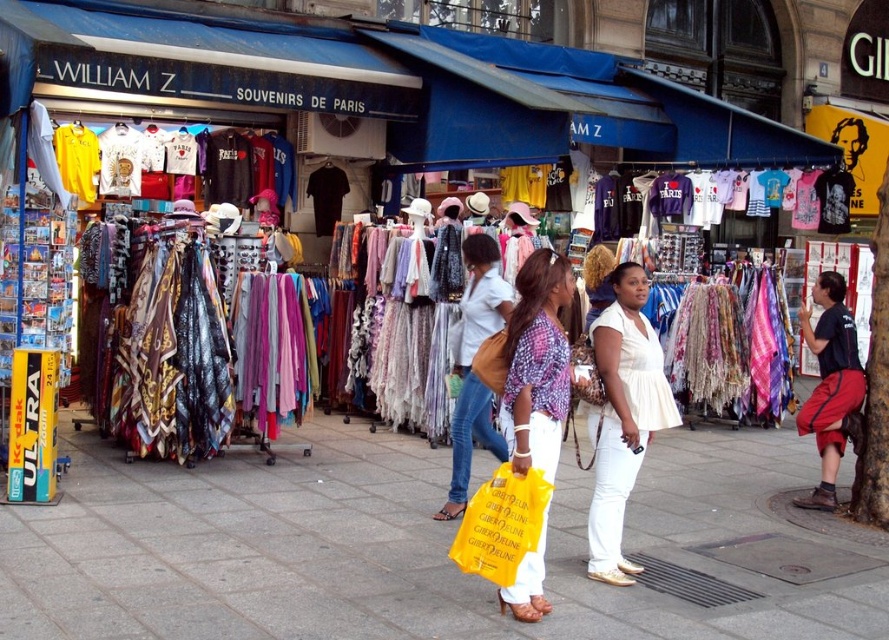
Identify the location of smooth concrete pavement at center. (404, 548).

Can you confirm if smooth concrete pavement at center is thinner than white cotton blouse at center?

Indeed, smooth concrete pavement at center has a lesser width compared to white cotton blouse at center.

Describe the element at coordinates (404, 548) in the screenshot. I see `smooth concrete pavement at center` at that location.

The height and width of the screenshot is (640, 889). What are the coordinates of `smooth concrete pavement at center` in the screenshot? It's located at (404, 548).

Is point (518, 381) positioned behind point (853, 365)?

No, it is in front of (853, 365).

Which is above, matte purple blouse at center or black cotton t-shirt at right?

black cotton t-shirt at right is above.

The image size is (889, 640). In order to click on matte purple blouse at center in this screenshot , I will do `click(537, 364)`.

Which is more to the left, smooth concrete pavement at center or matte brown handbag at center?

matte brown handbag at center is more to the left.

Is smooth concrete pavement at center thinner than matte brown handbag at center?

Indeed, smooth concrete pavement at center has a lesser width compared to matte brown handbag at center.

Is point (284, 596) positioned before point (449, 493)?

Yes, it is.

At what (x,y) coordinates should I click in order to perform the action: click on smooth concrete pavement at center. Please return your answer as a coordinate pair (x, y). Looking at the image, I should click on (404, 548).